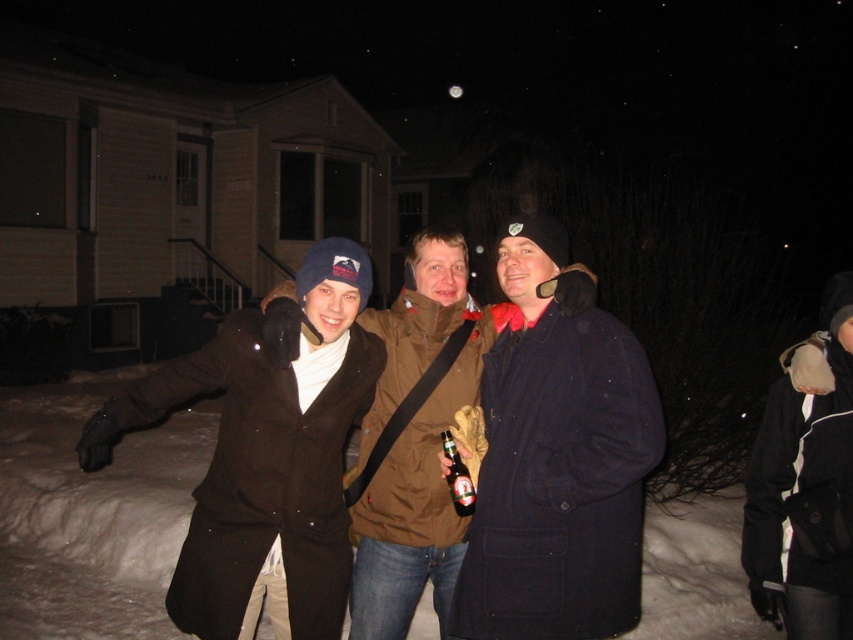
You are standing in front of the house and see the brown woolen coat at center and the translucent glass bottle at center. Which object is closer to you?

The brown woolen coat at center is closer to you because it is further to the viewer than the translucent glass bottle at center.

You are a photographer trying to capture a group photo of the matte brown coat at center and the black fuzzy hat at upper right. Since you want to ensure both subjects are in focus, you need to know their heights. Which one is taller?

The matte brown coat at center is much taller than the black fuzzy hat at upper right, so you should adjust your camera settings to accommodate the height difference for better focus.

Consider the image. You are standing in front of the house and see two points in the image. Which point is closer to you, point (379, 630) or point (453, 451)?

Point (379, 630) is closer to you than point (453, 451) because it is further to the viewer.